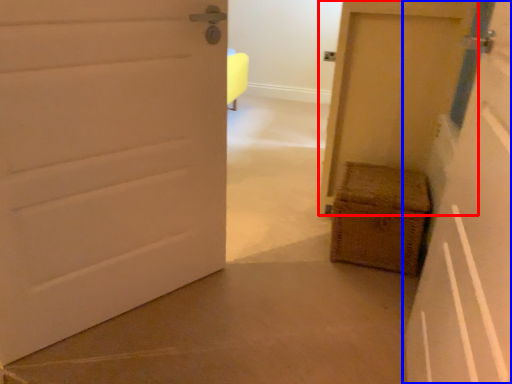
Question: Which object appears farthest to the camera in this image, door (highlighted by a red box) or door (highlighted by a blue box)?

Choices:
 (A) door
 (B) door

Answer: (A)